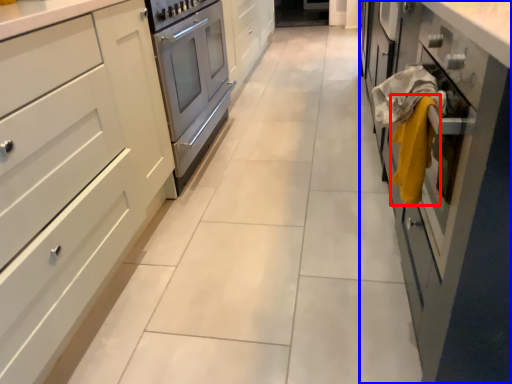
Question: Which of the following is the closest to the observer, blanket (highlighted by a red box) or cabinetry (highlighted by a blue box)?

Choices:
 (A) blanket
 (B) cabinetry

Answer: (B)